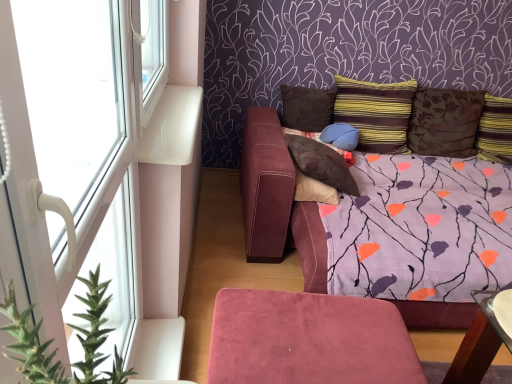
Image resolution: width=512 pixels, height=384 pixels. In order to click on vacant space situated above suede ottoman at lower center (from a real-world perspective) in this screenshot , I will do `click(309, 327)`.